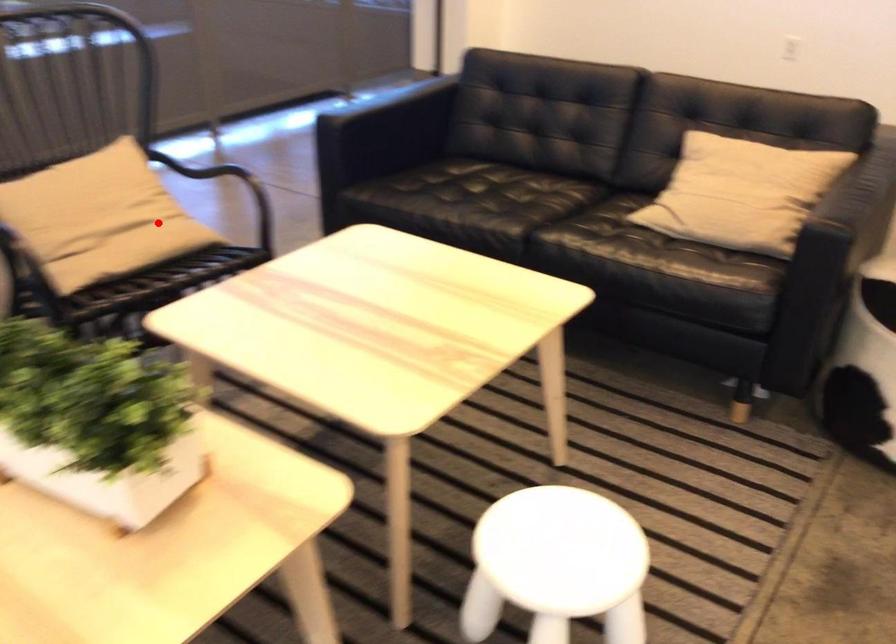
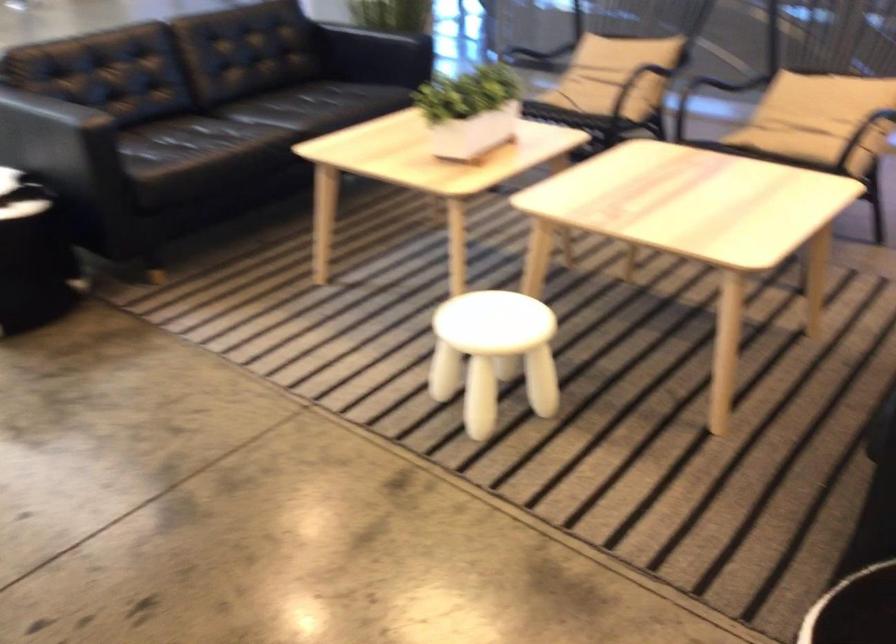
Question: A red point is marked in image1. In image2, is the corresponding 3D point closer to the camera or farther? Reply with the corresponding letter.

Choices:
 (A) The corresponding 3D point is closer.
 (B) The corresponding 3D point is farther.

Answer: (B)